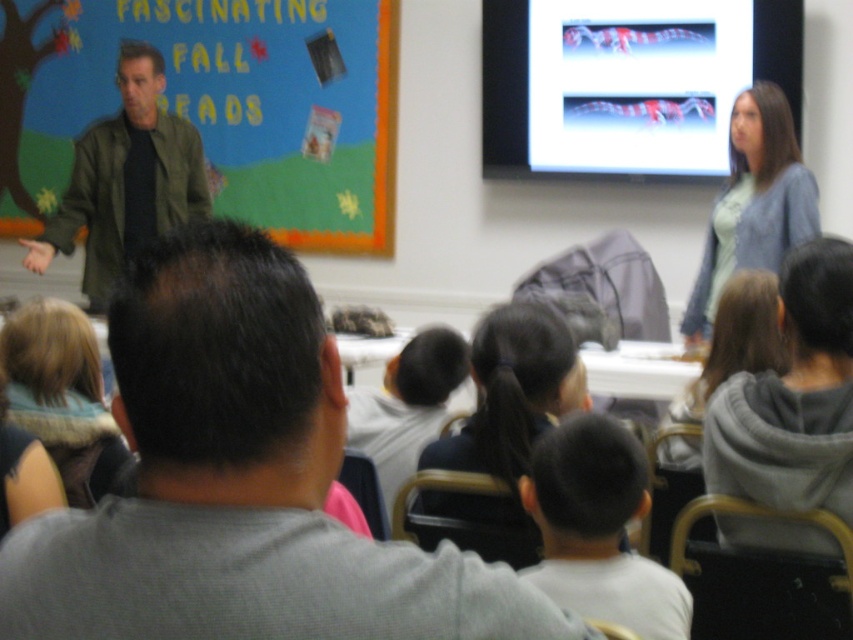
Question: Which object is the farthest from the matte plastic screen at upper right?

Choices:
 (A) black hair at center
 (B) gray cotton shirt at center
 (C) blonde hair scarf at lower left
 (D) green matte jacket at left

Answer: (B)

Question: Which point is closer to the camera?

Choices:
 (A) (538, 508)
 (B) (204, 106)
 (C) (593, 81)
 (D) (492, 323)

Answer: (A)

Question: Does gray hoodie at center appear under gray fleece sweatshirt at lower right?

Choices:
 (A) yes
 (B) no

Answer: (A)

Question: Which point is farther from the camera taking this photo?

Choices:
 (A) (730, 266)
 (B) (669, 177)
 (C) (618, 445)

Answer: (B)

Question: Can you confirm if black hair at center is positioned below gray fleece sweatshirt at lower right?

Choices:
 (A) no
 (B) yes

Answer: (B)

Question: Is gray hoodie at center smaller than gray fleece sweatshirt at lower right?

Choices:
 (A) no
 (B) yes

Answer: (B)